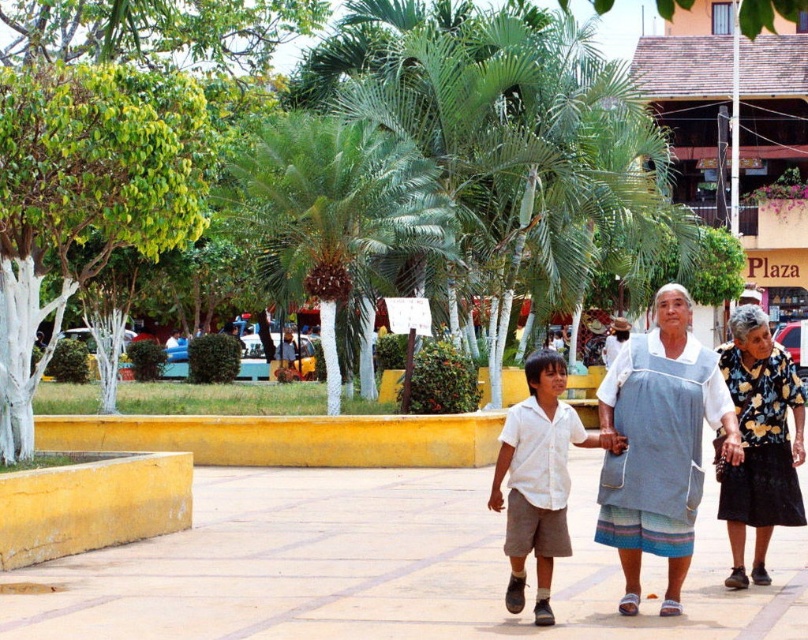
You are a photographer trying to capture the two people in the scene. You notice the floral print fabric skirt at right and the white cotton shirt at center. Which one is positioned to the right of the other?

The floral print fabric skirt at right is to the right of the white cotton shirt at center.

You are standing in the plaza and want to take a photo of both the point at coordinates (x=737, y=333) and the point at coordinates (x=548, y=419). Since you can only focus on one point at a time, which point should you focus on first to ensure the other is still in the background?

You should focus on the point at coordinates (x=548, y=419) first because the point at coordinates (x=737, y=333) is behind it. This way, when you focus on the closer point, the farther one will still be visible in the background.